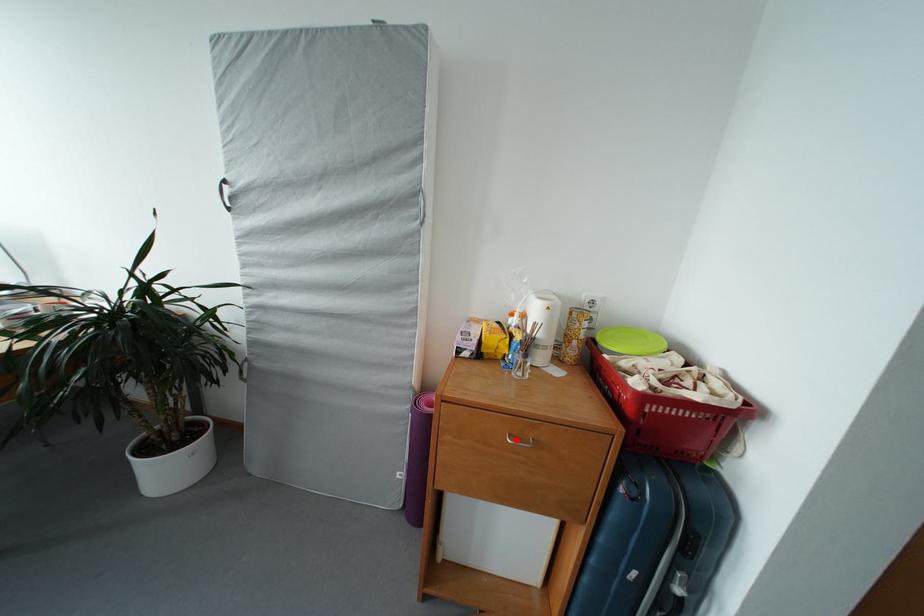
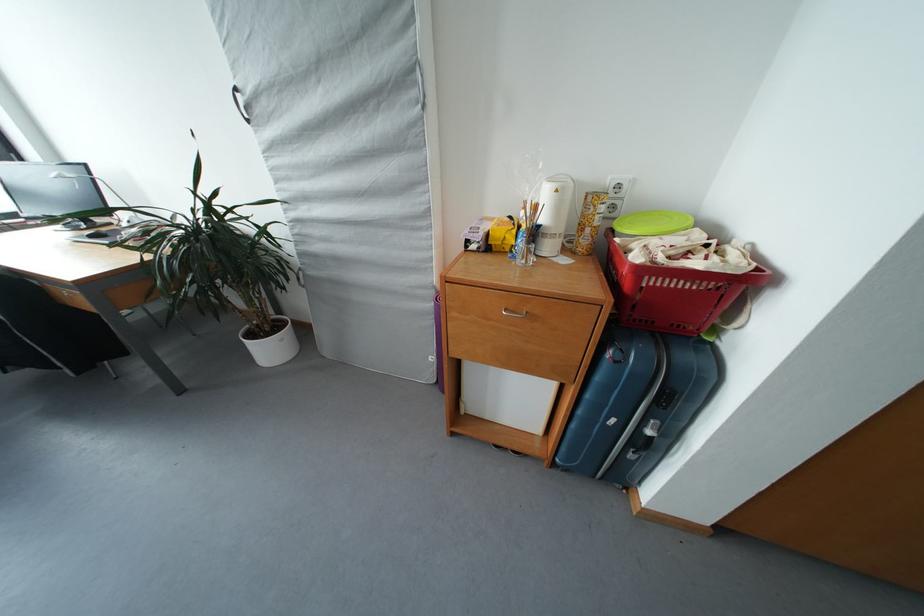
Find the pixel in the second image that matches the highlighted location in the first image.

(513, 314)